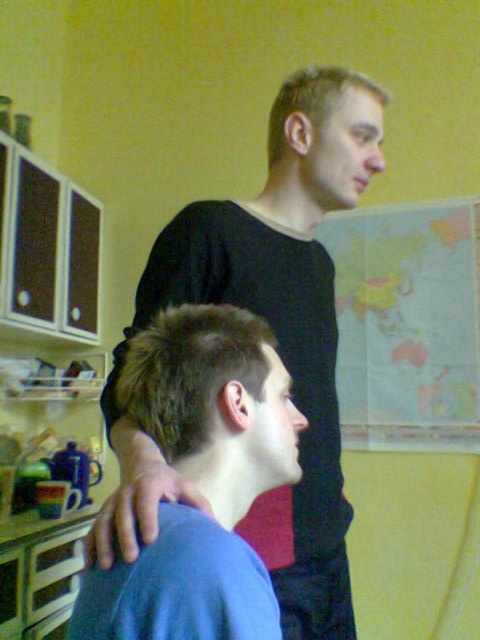
Question: Is black matte shirt at upper center positioned in front of blue matte shirt at center?

Choices:
 (A) no
 (B) yes

Answer: (A)

Question: Which point is closer to the camera?

Choices:
 (A) black matte shirt at upper center
 (B) blue matte shirt at center

Answer: (B)

Question: Does black matte shirt at upper center appear under blue matte shirt at center?

Choices:
 (A) yes
 (B) no

Answer: (B)

Question: Does black matte shirt at upper center appear on the right side of blue matte shirt at center?

Choices:
 (A) no
 (B) yes

Answer: (B)